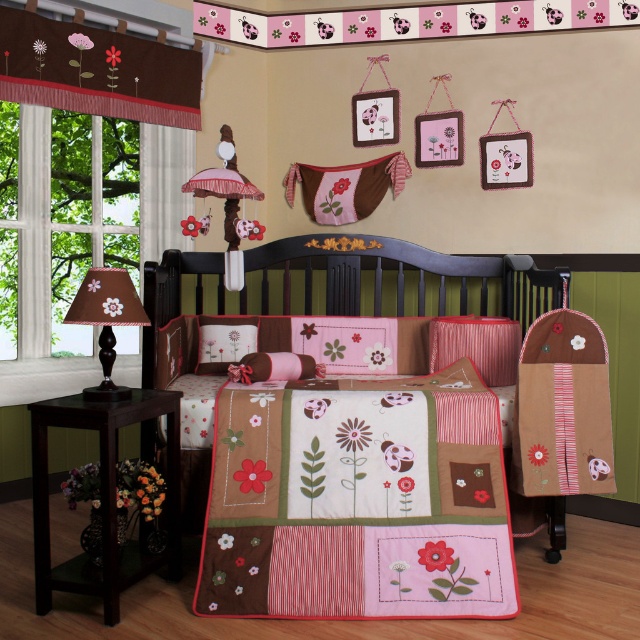
You are a parent holding a baby in your arms and want to place the baby in the crib. You notice two points in the room marked as point (x=86, y=60) and point (x=484, y=376). Which point is closer to you as you stand at the crib?

Point (x=86, y=60) is closer to you because it is further to the camera than point (x=484, y=376), meaning it is nearer to your position at the crib.

You are a parent setting up the nursery and want to know which item is wider between the brown fabric valance at upper left and the pink fabric pillow at center. Can you tell me which one is wider?

The brown fabric valance at upper left is wider than the pink fabric pillow at center according to the description.